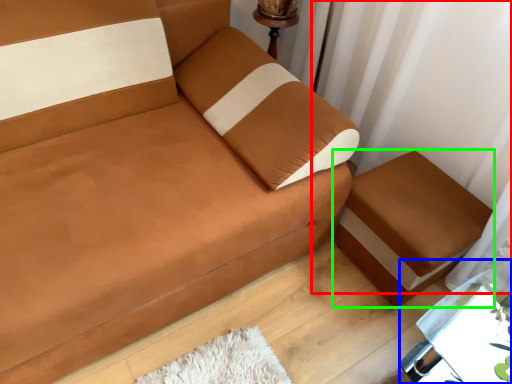
Question: Which object is the closest to the curtain (highlighted by a red box)? Choose among these: table (highlighted by a blue box) or furniture (highlighted by a green box).

Choices:
 (A) table
 (B) furniture

Answer: (B)